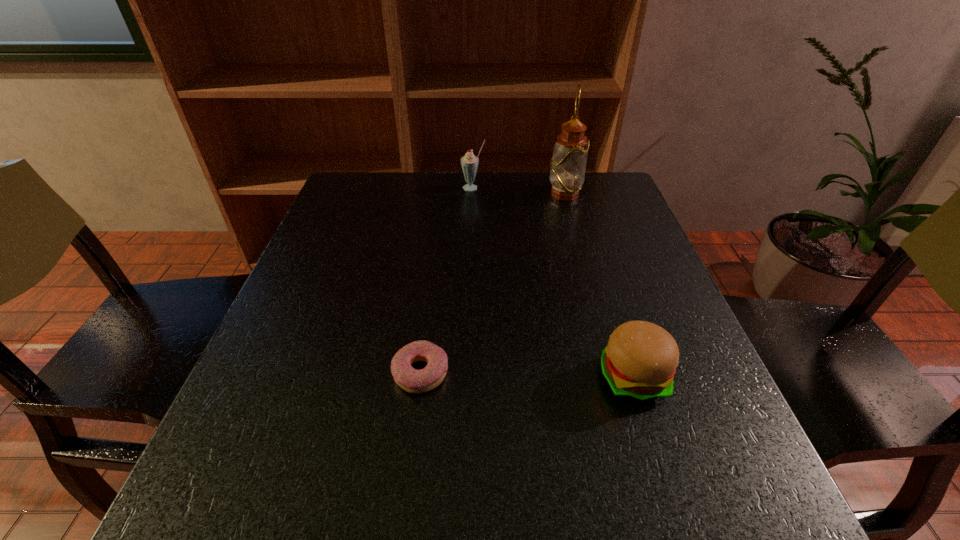
Find the location of a particular element. the tallest object is located at coordinates (568, 164).

You are a GUI agent. You are given a task and a screenshot of the screen. Output one action in this format:
    pyautogui.click(x=<x>, y=<y>)
    Task: Click on the third shortest object
    
    Given the screenshot: What is the action you would take?
    pyautogui.click(x=469, y=162)

Find the location of a particular element. The height and width of the screenshot is (540, 960). milkshake is located at coordinates point(469,162).

Locate an element on the screen. This screenshot has height=540, width=960. the third tallest object is located at coordinates (639, 363).

Where is `doughnut`? doughnut is located at coordinates (411, 380).

Find the location of `the shortest object`. the shortest object is located at coordinates (411, 380).

I want to click on free space located 0.090m on the right of the oil lamp, so click(613, 194).

I want to click on free space located 0.190m on the straw side of the second object from left to right, so click(472, 231).

Find the location of a particular element. vacant region located 0.160m on the front of the hamburger is located at coordinates (675, 511).

Where is `free space located on the right of the shortest object`? free space located on the right of the shortest object is located at coordinates (677, 372).